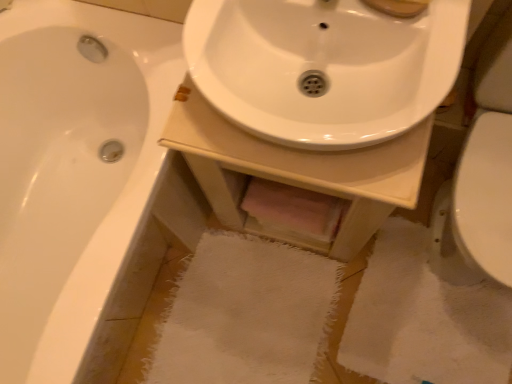
Question: Considering their positions, is white glossy bathtub at left located in front of or behind white glossy sink at center?

Choices:
 (A) front
 (B) behind

Answer: (B)

Question: Choose the correct answer: Is white glossy bathtub at left inside white glossy sink at center or outside it?

Choices:
 (A) outside
 (B) inside

Answer: (A)

Question: Considering the real-world distances, which object is closest to the white glossy bathtub at left?

Choices:
 (A) white glossy sink at center
 (B) white glossy sink at center

Answer: (A)

Question: Estimate the real-world distances between objects in this image. Which object is farther from the white glossy sink at center?

Choices:
 (A) white glossy sink at center
 (B) white glossy bathtub at left

Answer: (B)